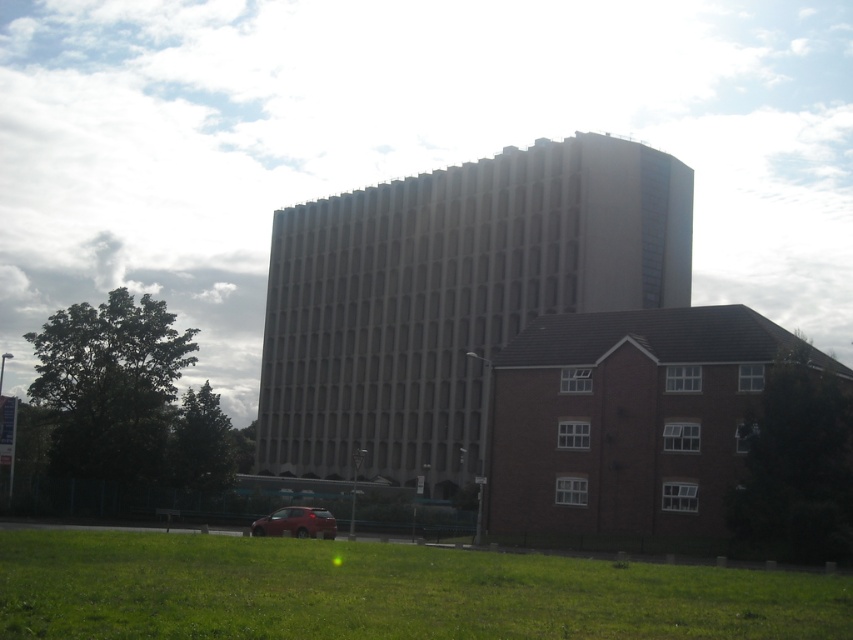
Question: Can you confirm if beige concrete building at center is bigger than metallic red hatchback at lower center?

Choices:
 (A) no
 (B) yes

Answer: (B)

Question: Based on their relative distances, which object is nearer to the metallic red hatchback at lower center?

Choices:
 (A) beige concrete building at center
 (B) green grass at lower center

Answer: (B)

Question: Can you confirm if green grass at lower center is positioned below metallic red hatchback at lower center?

Choices:
 (A) yes
 (B) no

Answer: (B)

Question: Can you confirm if beige concrete building at center is thinner than green grass at lower center?

Choices:
 (A) no
 (B) yes

Answer: (A)

Question: Among these objects, which one is nearest to the camera?

Choices:
 (A) beige concrete building at center
 (B) metallic red hatchback at lower center
 (C) green grass at lower center

Answer: (C)

Question: Estimate the real-world distances between objects in this image. Which object is closer to the metallic red hatchback at lower center?

Choices:
 (A) green grass at lower center
 (B) beige concrete building at center

Answer: (A)